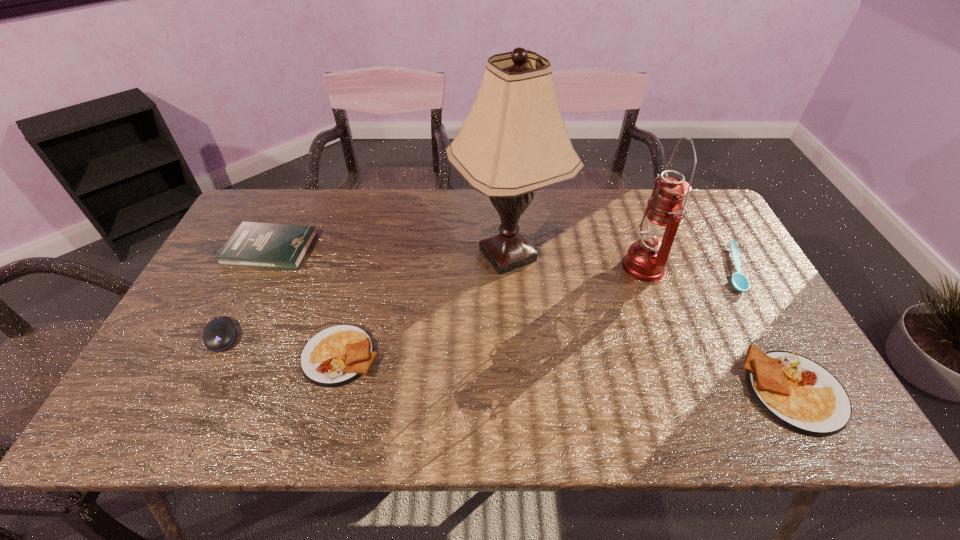
Identify the location of free space at the far right corner of the desktop. The height and width of the screenshot is (540, 960). (710, 217).

Image resolution: width=960 pixels, height=540 pixels. Find the location of `free space between the fourth object from left to right and the fifth object from right to left`. free space between the fourth object from left to right and the fifth object from right to left is located at coordinates (424, 305).

You are a GUI agent. You are given a task and a screenshot of the screen. Output one action in this format:
    pyautogui.click(x=<x>, y=<y>)
    Task: Click on the free spot between the taller omelet and the sixth shortest object
    This screenshot has width=960, height=540.
    Given the screenshot: What is the action you would take?
    719,328

This screenshot has height=540, width=960. What are the coordinates of `vacant area that lies between the taller omelet and the shortest object` in the screenshot? It's located at (764, 330).

Locate an element on the screen. This screenshot has height=540, width=960. vacant point located between the right omelet and the shortest object is located at coordinates (764, 330).

At what (x,y) coordinates should I click in order to perform the action: click on unoccupied position between the spoon and the taller omelet. Please return your answer as a coordinate pair (x, y). The width and height of the screenshot is (960, 540). Looking at the image, I should click on (764, 330).

Locate an element on the screen. The width and height of the screenshot is (960, 540). vacant area between the taller omelet and the shortest object is located at coordinates (764, 330).

Identify the location of unoccupied position between the book and the lamp. (389, 252).

Where is `vacant area that lies between the fifth object from left to right and the book`? The width and height of the screenshot is (960, 540). vacant area that lies between the fifth object from left to right and the book is located at coordinates (457, 258).

Where is `empty space that is in between the second tallest object and the lamp`? This screenshot has height=540, width=960. empty space that is in between the second tallest object and the lamp is located at coordinates (576, 260).